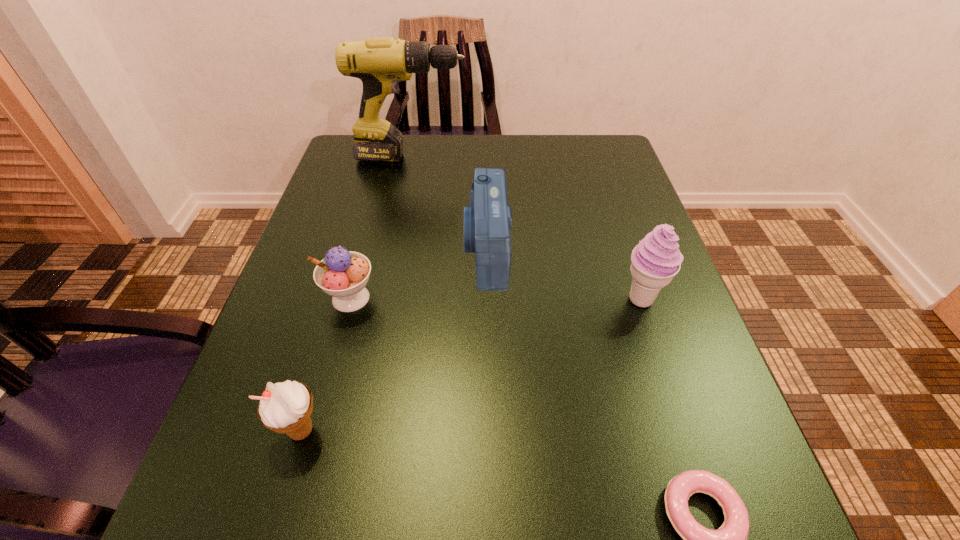
Identify the location of vacant area in the image that satisfies the following two spatial constraints: 1. on the handle side of the farthest object; 2. on the left side of the second tallest object. (382, 299).